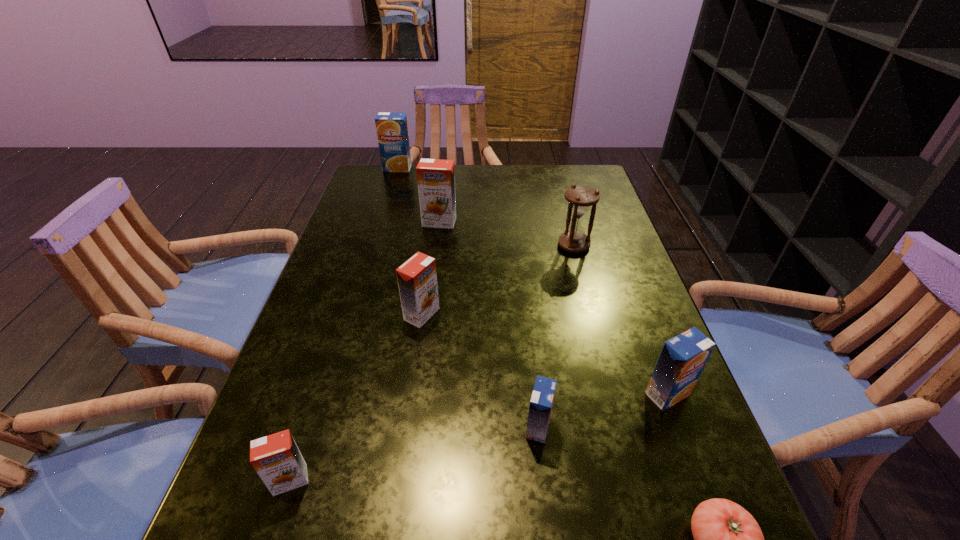
Locate an element on the screen. the smallest blue orange_juice is located at coordinates (541, 403).

This screenshot has height=540, width=960. In order to click on the second blue orange_juice from left to right in this screenshot , I will do `click(541, 403)`.

I want to click on the nearest orange orange juice, so click(x=276, y=458).

Where is `the smallest orange orange juice`? The width and height of the screenshot is (960, 540). the smallest orange orange juice is located at coordinates (276, 458).

Where is `vacant area situated on the right of the farthest object`? This screenshot has height=540, width=960. vacant area situated on the right of the farthest object is located at coordinates (526, 168).

This screenshot has height=540, width=960. In order to click on vacant space located 0.240m on the back of the biggest orange orange juice in this screenshot , I will do `click(445, 176)`.

Identify the location of free space located on the back of the hourglass. (558, 185).

Find the location of a particular element. The width and height of the screenshot is (960, 540). free space located 0.200m on the back of the second smallest orange orange juice is located at coordinates (431, 248).

The width and height of the screenshot is (960, 540). What are the coordinates of `free space located 0.260m on the left of the fourth farthest orange juice` in the screenshot? It's located at (506, 394).

Where is `free space located on the back of the second blue orange_juice from left to right`? This screenshot has width=960, height=540. free space located on the back of the second blue orange_juice from left to right is located at coordinates (529, 340).